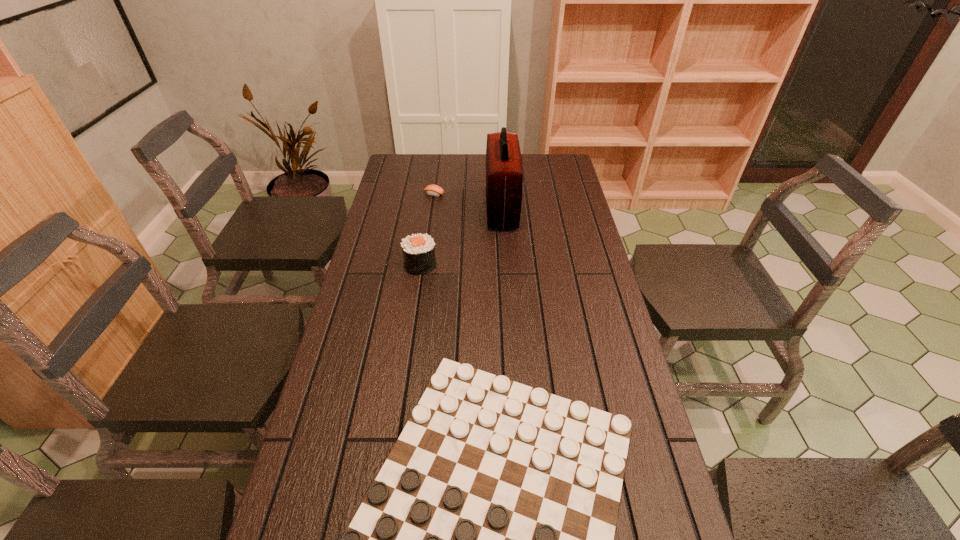
Locate an element on the screen. This screenshot has height=540, width=960. the first aid kit is located at coordinates point(503,174).

Where is `the second nearest object`? This screenshot has height=540, width=960. the second nearest object is located at coordinates (418, 250).

At what (x,y) coordinates should I click in order to perform the action: click on the taller sushi. Please return your answer as a coordinate pair (x, y). This screenshot has width=960, height=540. Looking at the image, I should click on (418, 250).

Where is `the shorter sushi`? This screenshot has height=540, width=960. the shorter sushi is located at coordinates (433, 190).

Where is `vacant space situated on the side of the tallest object with the cross symbol`? This screenshot has width=960, height=540. vacant space situated on the side of the tallest object with the cross symbol is located at coordinates (420, 208).

Find the location of a particular element. The image size is (960, 540). vacant space located 0.210m on the side of the tallest object with the cross symbol is located at coordinates (430, 208).

What are the coordinates of `free spot located 0.230m on the side of the tallest object with the cross symbol` in the screenshot? It's located at click(424, 208).

I want to click on free space located 0.060m on the front of the nearer sushi, so click(x=417, y=289).

I want to click on free spot located 0.070m on the front of the shorter sushi, so click(432, 208).

Identify the location of object situated at the left edge. (418, 250).